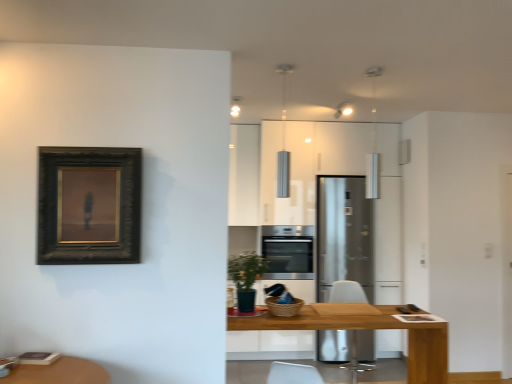
Question: Is satin silver refrigerator at center completely or partially inside wooden table at center?

Choices:
 (A) yes
 (B) no

Answer: (B)

Question: Considering the relative sizes of wooden table at center and satin silver refrigerator at center in the image provided, is wooden table at center bigger than satin silver refrigerator at center?

Choices:
 (A) no
 (B) yes

Answer: (A)

Question: Considering the relative sizes of wooden table at center and satin silver refrigerator at center in the image provided, is wooden table at center smaller than satin silver refrigerator at center?

Choices:
 (A) yes
 (B) no

Answer: (A)

Question: Does wooden table at center have a greater width compared to satin silver refrigerator at center?

Choices:
 (A) no
 (B) yes

Answer: (A)

Question: Does wooden table at center have a greater height compared to satin silver refrigerator at center?

Choices:
 (A) yes
 (B) no

Answer: (B)

Question: Does wooden table at center come in front of satin silver refrigerator at center?

Choices:
 (A) yes
 (B) no

Answer: (A)

Question: Are dark wood frame at upper left and satin silver refrigerator at center beside each other?

Choices:
 (A) yes
 (B) no

Answer: (B)

Question: Is satin silver refrigerator at center surrounded by dark wood frame at upper left?

Choices:
 (A) yes
 (B) no

Answer: (B)

Question: Is dark wood frame at upper left wider than satin silver refrigerator at center?

Choices:
 (A) yes
 (B) no

Answer: (B)

Question: From a real-world perspective, does dark wood frame at upper left stand above satin silver refrigerator at center?

Choices:
 (A) no
 (B) yes

Answer: (B)

Question: Is dark wood frame at upper left aimed at satin silver refrigerator at center?

Choices:
 (A) no
 (B) yes

Answer: (A)

Question: Considering the relative sizes of dark wood frame at upper left and satin silver refrigerator at center in the image provided, is dark wood frame at upper left shorter than satin silver refrigerator at center?

Choices:
 (A) yes
 (B) no

Answer: (A)

Question: Is satin silver refrigerator at center oriented away from white plastic swivel chair at center?

Choices:
 (A) no
 (B) yes

Answer: (A)